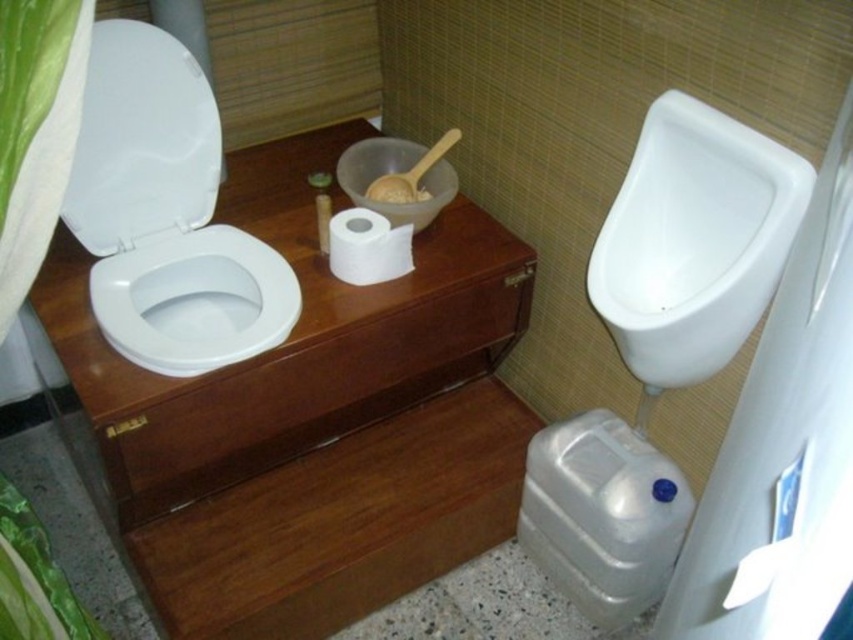
Is point (393, 228) positioned in front of point (415, 184)?

Yes, point (393, 228) is in front of point (415, 184).

Image resolution: width=853 pixels, height=640 pixels. Describe the element at coordinates (367, 248) in the screenshot. I see `white matte toilet paper at center` at that location.

I want to click on white matte toilet paper at center, so click(367, 248).

Between white glossy urinal at right and white glossy toilet bowl at left, which one appears on the right side from the viewer's perspective?

From the viewer's perspective, white glossy urinal at right appears more on the right side.

Is point (633, 353) closer to viewer compared to point (120, 316)?

Yes, it is in front of point (120, 316).

Where is `white glossy urinal at right`? The image size is (853, 640). white glossy urinal at right is located at coordinates (694, 241).

Who is taller, white glossy toilet lid at upper left or white glossy toilet bowl at left?

With more height is white glossy toilet lid at upper left.

Can you confirm if white glossy toilet lid at upper left is positioned above white glossy toilet bowl at left?

Indeed, white glossy toilet lid at upper left is positioned over white glossy toilet bowl at left.

Locate an element on the screen. white glossy toilet lid at upper left is located at coordinates (141, 141).

Identify the location of white glossy toilet lid at upper left. The height and width of the screenshot is (640, 853). (141, 141).